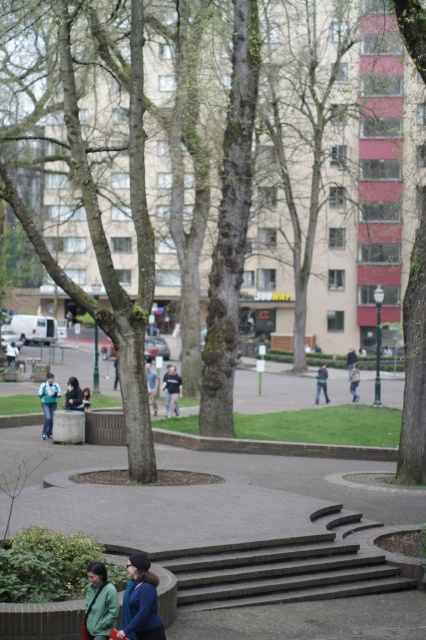
Question: Among these objects, which one is farthest from the camera?

Choices:
 (A) green matte jacket at lower left
 (B) dark blue jeans at center
 (C) matte black backpack at center

Answer: (B)

Question: Does matte black backpack at center have a larger size compared to matte black jacket at lower center?

Choices:
 (A) no
 (B) yes

Answer: (B)

Question: Where is dark blue jeans at center located in relation to matte black jacket at lower center in the image?

Choices:
 (A) right
 (B) left

Answer: (A)

Question: Which object appears farthest from the camera in this image?

Choices:
 (A) matte black jacket at lower center
 (B) teal fabric backpack at center
 (C) matte black beanie at lower center
 (D) green matte jacket at lower left

Answer: (A)

Question: Where is matte black backpack at center located in relation to matte black jacket at lower center in the image?

Choices:
 (A) left
 (B) right

Answer: (A)

Question: Based on their relative distances, which object is nearer to the brown wooden stairs at lower center?

Choices:
 (A) matte black beanie at lower center
 (B) green matte jacket at lower left
 (C) matte black jacket at lower center
 (D) matte black backpack at center

Answer: (A)